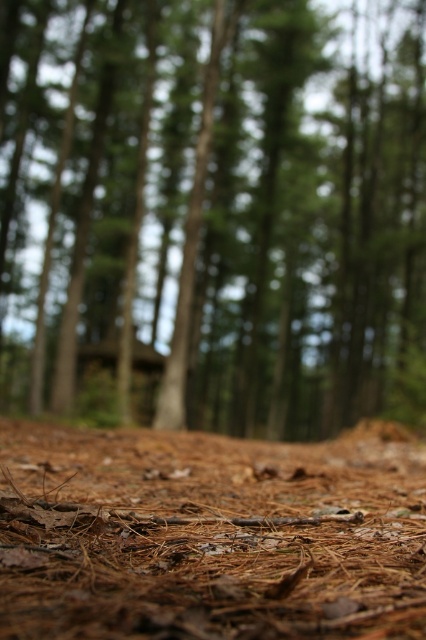
You are a small insect exploring the forest floor. You notice the brown textured ground at lower center and the brown pine needles at lower center. Which of these two features covers a larger area in the immediate vicinity?

The brown textured ground at lower center covers a larger area than the brown pine needles at lower center.

From the picture: In the forest scene, you are standing at the point marked as point (216, 211). What is the ground texture like at that location?

The brown textured ground at lower center is located at point (216, 211), so the ground texture there is brown and textured.

You are a photographer trying to capture a closeup of the forest floor. You notice two points marked in the scene. Which point, point (x=141, y=241) or point (x=327, y=499), is closer to your camera lens?

Point (x=141, y=241) is further to the camera than point (x=327, y=499), so the point closer to the camera lens is point (x=141, y=241).